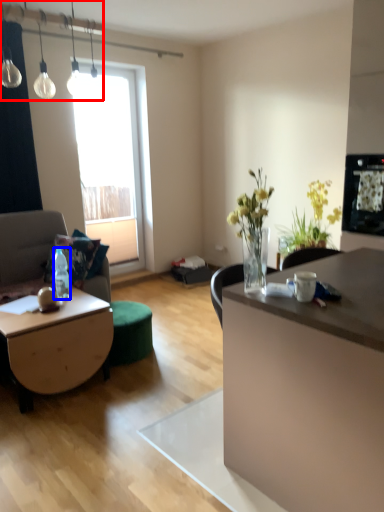
Question: Which object is closer to the camera taking this photo, lamp (highlighted by a red box) or bottle (highlighted by a blue box)?

Choices:
 (A) lamp
 (B) bottle

Answer: (A)